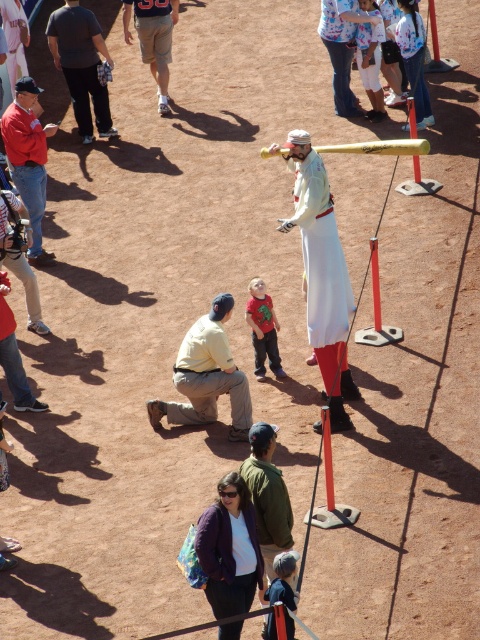
Which is more to the left, smooth wooden bat at center or smooth orange pole at center?

smooth wooden bat at center is more to the left.

Can you confirm if smooth wooden bat at center is thinner than smooth orange pole at center?

Yes, smooth wooden bat at center is thinner than smooth orange pole at center.

Does point (326, 490) lie behind point (377, 292)?

No, it is not.

At what (x,y) coordinates should I click in order to perform the action: click on smooth wooden bat at center. Please return your answer as a coordinate pair (x, y). The width and height of the screenshot is (480, 640). Looking at the image, I should click on (327, 458).

Between matte red jacket at left and smooth wooden bat at center, which one has less height?

Standing shorter between the two is smooth wooden bat at center.

Which is above, matte red jacket at left or smooth wooden bat at center?

matte red jacket at left is higher up.

Locate an element on the screen. The height and width of the screenshot is (640, 480). matte red jacket at left is located at coordinates (28, 160).

The image size is (480, 640). What are the coordinates of `matte red jacket at left` in the screenshot? It's located at [x=28, y=160].

Can you confirm if white fabric statue at center is shorter than smooth yellow bat at center?

No, white fabric statue at center is not shorter than smooth yellow bat at center.

Can you confirm if white fabric statue at center is taller than smooth yellow bat at center?

Yes, white fabric statue at center is taller than smooth yellow bat at center.

Locate an element on the screen. This screenshot has height=640, width=480. white fabric statue at center is located at coordinates (323, 275).

Identify the location of white fabric statue at center. The image size is (480, 640). (323, 275).